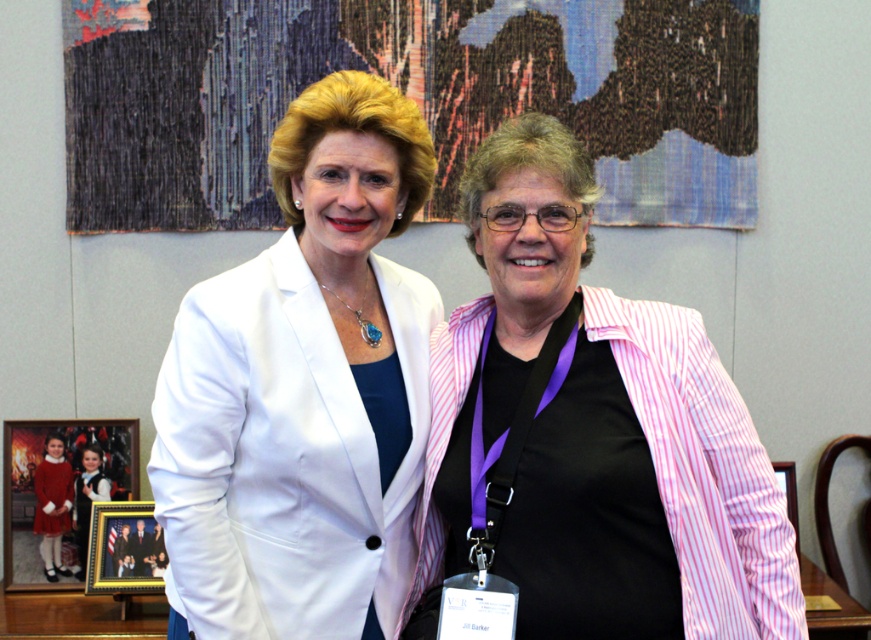
Based on the photo, is pink striped blazer at center closer to camera compared to white matte blazer at center?

That is True.

Can you confirm if pink striped blazer at center is positioned above white matte blazer at center?

No.

Identify the location of pink striped blazer at center. (596, 429).

The width and height of the screenshot is (871, 640). What are the coordinates of `pink striped blazer at center` in the screenshot? It's located at (596, 429).

Between white matte blazer at center and wooden picture frame at right, which one has less height?

wooden picture frame at right is shorter.

The width and height of the screenshot is (871, 640). I want to click on white matte blazer at center, so click(x=302, y=390).

Between gold-framed picture at lower left and wooden picture frame at right, which one has more height?

wooden picture frame at right

Who is positioned more to the left, gold-framed picture at lower left or wooden picture frame at right?

Positioned to the left is gold-framed picture at lower left.

Who is more distant from viewer, (x=91, y=545) or (x=790, y=502)?

The point (x=790, y=502) is more distant.

Locate an element on the screen. Image resolution: width=871 pixels, height=640 pixels. gold-framed picture at lower left is located at coordinates (125, 548).